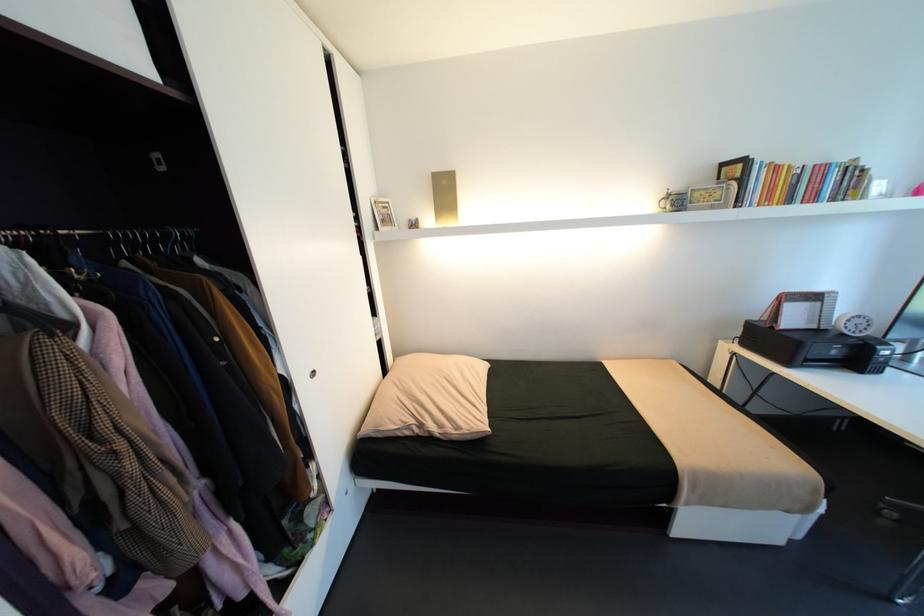
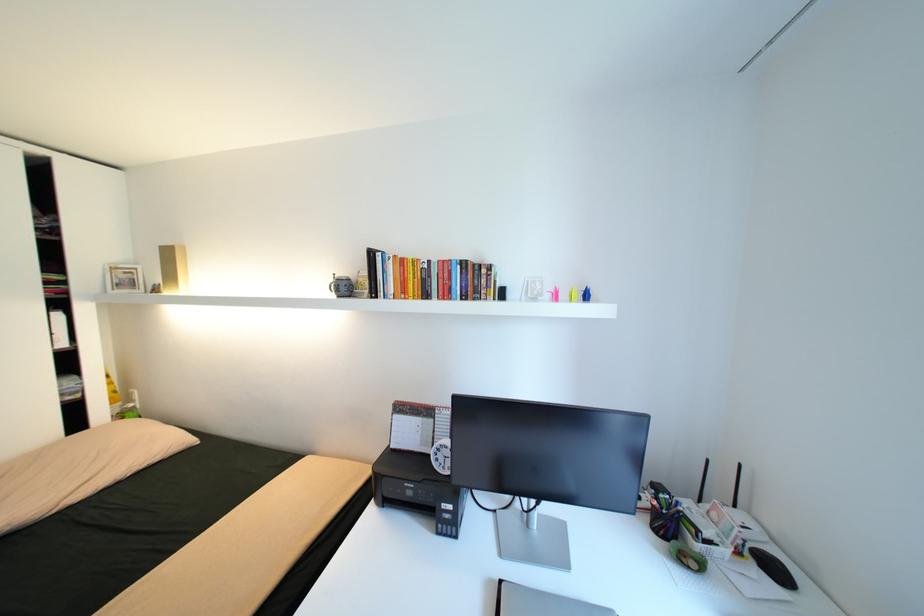
The point at [833,296] is marked in the first image. Where is the corresponding point in the second image?

(444, 411)